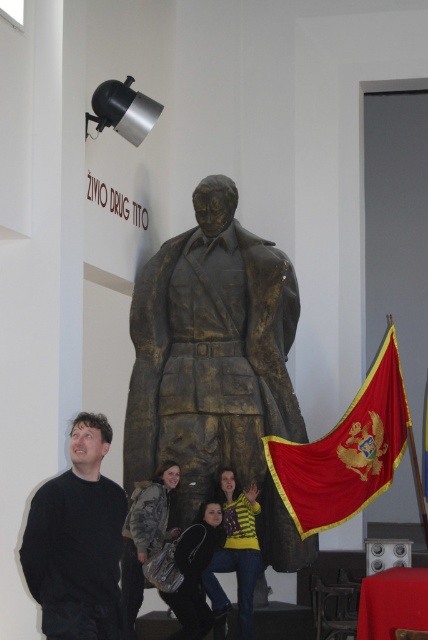
You are a photographer standing in front of the bronze statue. You want to take a photo that includes both the yellow striped sweater at center and the camouflage fabric jacket at lower center. Which object should appear closer to the camera in the photo?

The yellow striped sweater at center should appear closer to the camera because it is further to the viewer than the camouflage fabric jacket at lower center.

You are a photographer trying to capture both the yellow striped sweater at center and the camouflage fabric jacket at lower center in the same frame. Given that your camera has a 1.5 meter field of view, can you fit both objects into the frame without moving closer or further away?

The yellow striped sweater at center and camouflage fabric jacket at lower center are 4.60 meters apart, which exceeds the camera field of view of 1.5 meters. Therefore, you cannot fit both objects into the frame without adjusting your position.